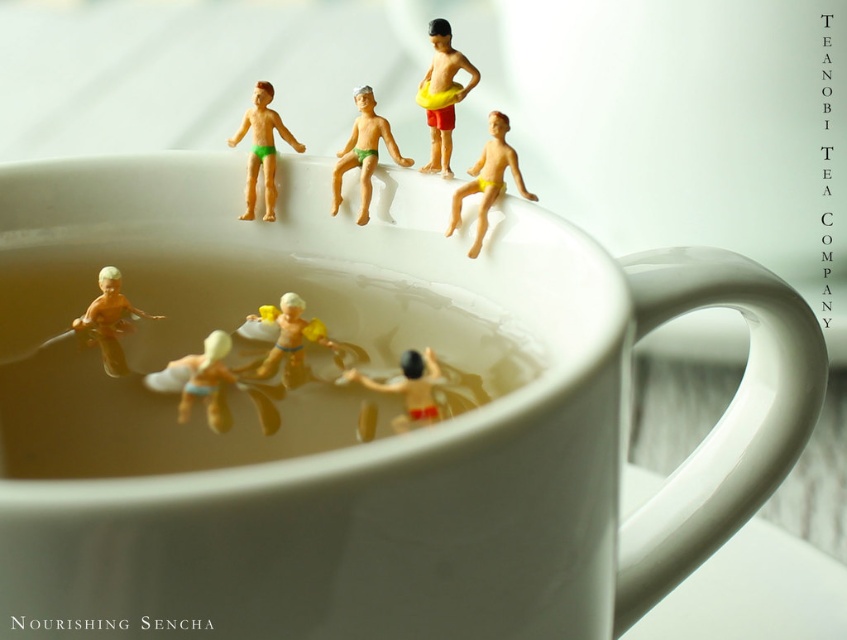
You are a customer at a cafe and see the white glossy mug at upper center and the matte yellow plastic surfboard at lower center. Which object is closer to the right edge of the table?

The white glossy mug at upper center is closer to the right edge of the table because it is positioned on the right side of the matte yellow plastic surfboard at lower center.

You are a tiny observer sitting on the rim of the mug. You see the green matte toy at upper center and the matte yellow plastic boy at lower left. Which of these two objects is directly above the other?

The green matte toy at upper center is positioned over the matte yellow plastic boy at lower left.